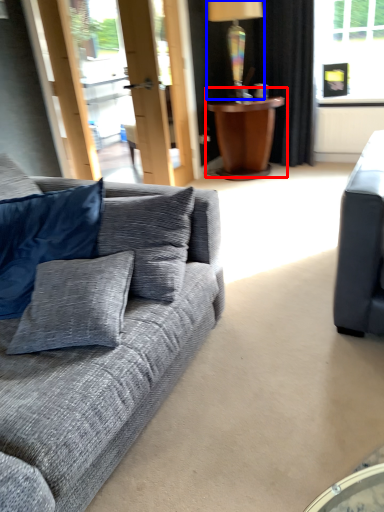
Question: Which of the following is the farthest to the observer, table (highlighted by a red box) or lamp (highlighted by a blue box)?

Choices:
 (A) table
 (B) lamp

Answer: (A)